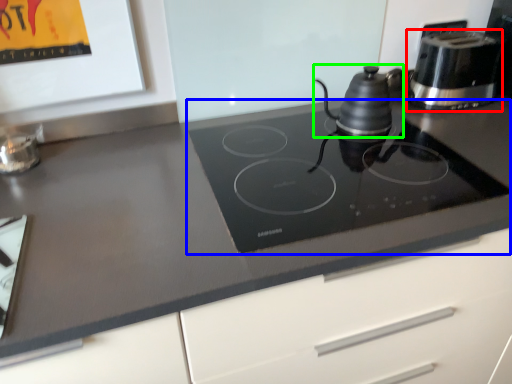
Question: Which is farther away from kitchen appliance (highlighted by a red box)? gas stove (highlighted by a blue box) or kitchen appliance (highlighted by a green box)?

Choices:
 (A) gas stove
 (B) kitchen appliance

Answer: (A)